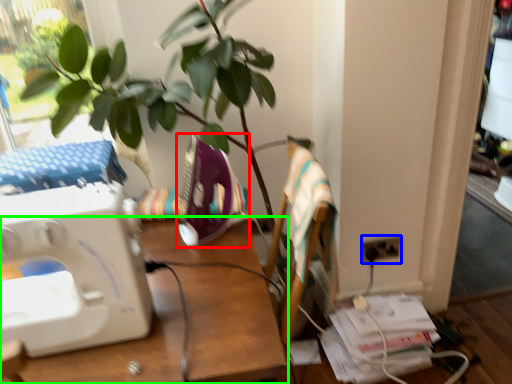
Question: Which object is the closest to the sewing machine (highlighted by a red box)? Choose among these: electric outlet (highlighted by a blue box) or desk (highlighted by a green box).

Choices:
 (A) electric outlet
 (B) desk

Answer: (B)